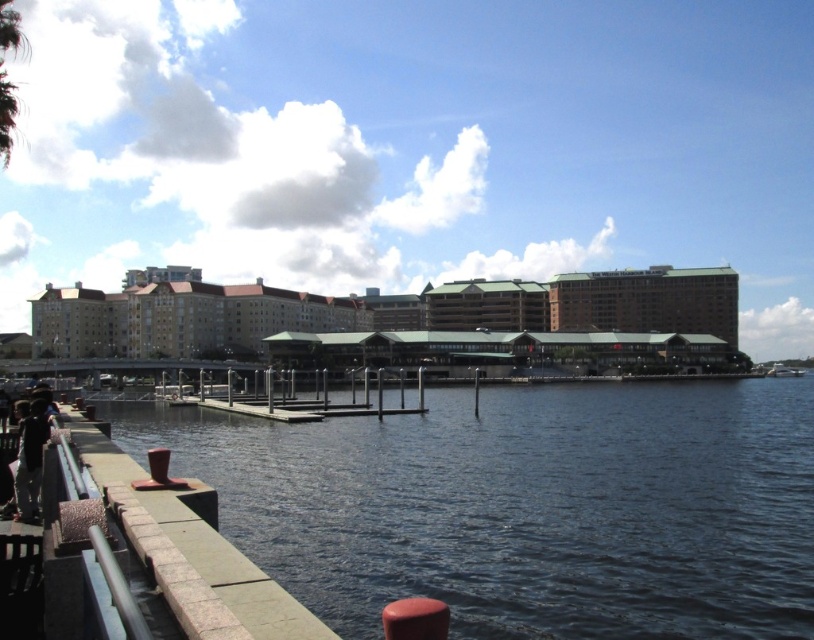
You are standing at the waterfront and want to take a photo of the brown brick building at center. If your camera has a maximum zoom range of 100 meters, will you be able to capture the entire building in the photo without moving closer?

The distance between you and the brown brick building at center is 129.42 meters. Since your camera can only zoom up to 100 meters, you won cannot capture the entire building without moving closer.

You are standing at the stone walkway with metal railings and red bollards. You see two points marked in the image, point 1 at coordinates point (667, 273) and point 2 at coordinates point (20, 472). Which point is closer to you?

Point (20, 472) is closer to you because it is in front of point (667, 273).

You are standing at the center of the stone walkway and want to reach the dark blue water at lower left. Based on the coordinates provided, in which direction should you move to get there?

The dark blue water at lower left is located at coordinates point (524, 506), so you should move towards the lower left direction to reach it.